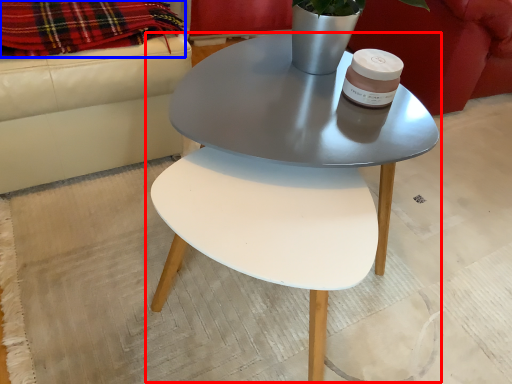
Question: Which object appears closest to the camera in this image, coffee table (highlighted by a red box) or blanket (highlighted by a blue box)?

Choices:
 (A) coffee table
 (B) blanket

Answer: (A)